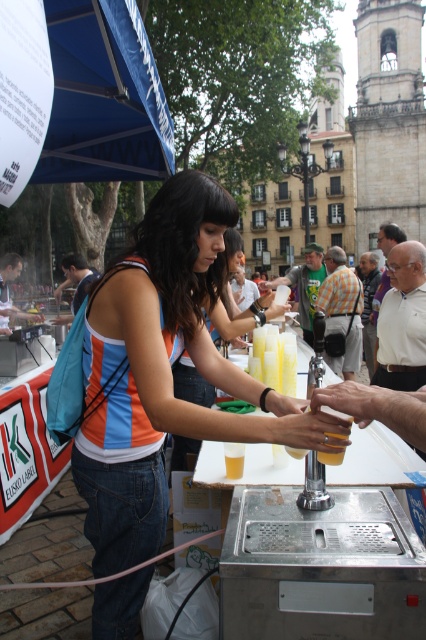
Is white cotton shirt at center thinner than green fabric shirt at center?

Yes.

Is point (402, 332) positioned before point (316, 259)?

Yes, point (402, 332) is in front of point (316, 259).

Locate an element on the screen. white cotton shirt at center is located at coordinates (402, 321).

Does checkered fabric shirt at center appear on the left side of blue denim jeans at lower left?

In fact, checkered fabric shirt at center is to the right of blue denim jeans at lower left.

Who is more distant from viewer, (x=345, y=292) or (x=54, y=317)?

Point (x=54, y=317)

I want to click on checkered fabric shirt at center, so click(342, 310).

Which is behind, point (149, 540) or point (78, 253)?

The point (78, 253) is behind.

Does point (115, 460) lie in front of point (69, 280)?

Yes, point (115, 460) is in front of point (69, 280).

Does point (203, 324) come behind point (80, 257)?

No.

The image size is (426, 640). Find the location of `matte orange tank top at center`. matte orange tank top at center is located at coordinates (161, 371).